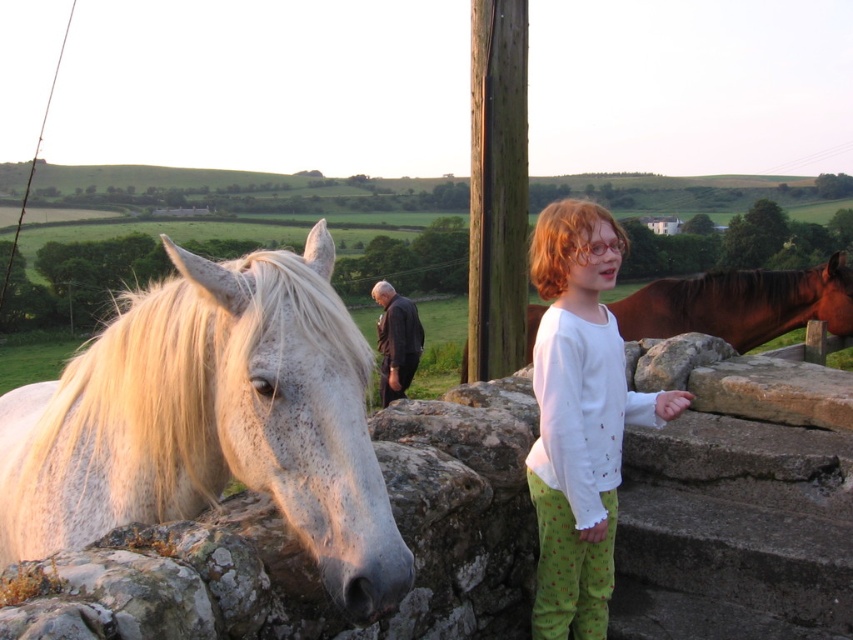
Which is above, white speckled fur at left or white cotton shirt at upper right?

white speckled fur at left is higher up.

Is white speckled fur at left taller than white cotton shirt at upper right?

In fact, white speckled fur at left may be shorter than white cotton shirt at upper right.

Find the location of a particular element. This screenshot has width=853, height=640. white speckled fur at left is located at coordinates (212, 420).

Consider the image. Between white speckled fur at left and shiny brown horse at right, which one appears on the right side from the viewer's perspective?

shiny brown horse at right is more to the right.

Is point (167, 332) in front of point (637, 312)?

Yes.

Who is more forward, [250,275] or [704,307]?

Point [250,275] is more forward.

Locate an element on the screen. This screenshot has width=853, height=640. white speckled fur at left is located at coordinates (212, 420).

In the scene shown: Is white cotton shirt at upper right closer to the viewer compared to shiny brown horse at right?

That is True.

Does point (624, 365) lie in front of point (692, 328)?

Yes, point (624, 365) is in front of point (692, 328).

This screenshot has height=640, width=853. Find the location of `white cotton shirt at upper right`. white cotton shirt at upper right is located at coordinates (579, 417).